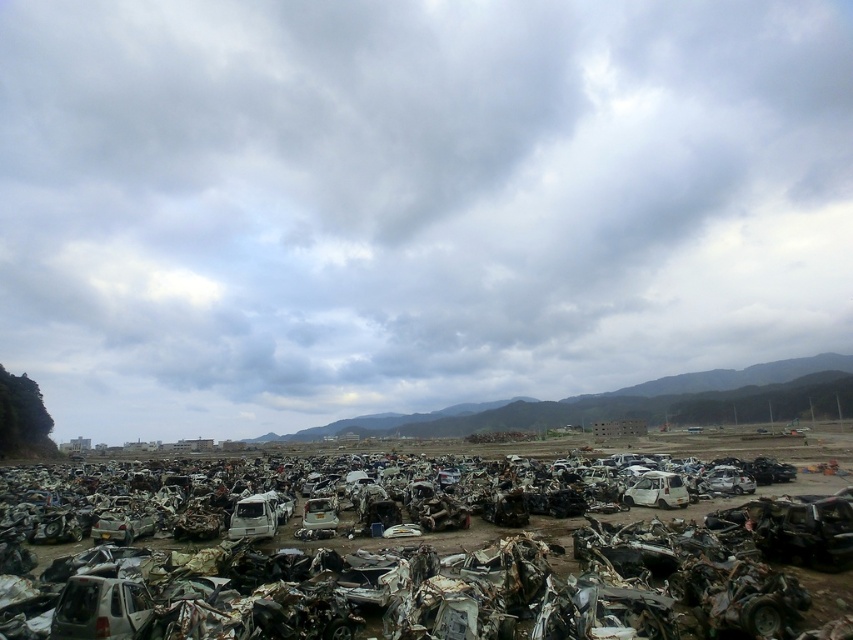
Question: Which object appears closest to the camera in this image?

Choices:
 (A) white matte car at lower left
 (B) rusty metal car at lower left

Answer: (A)

Question: Does rusty metal car at lower left have a smaller size compared to white matte car at lower left?

Choices:
 (A) yes
 (B) no

Answer: (B)

Question: Where is rusty metal car at lower left located in relation to white matte car at lower left in the image?

Choices:
 (A) left
 (B) right

Answer: (A)

Question: Does rusty metal car at lower left appear over white matte car at lower left?

Choices:
 (A) no
 (B) yes

Answer: (A)

Question: Which point is farther from the camera taking this photo?

Choices:
 (A) (526, 550)
 (B) (109, 592)

Answer: (A)